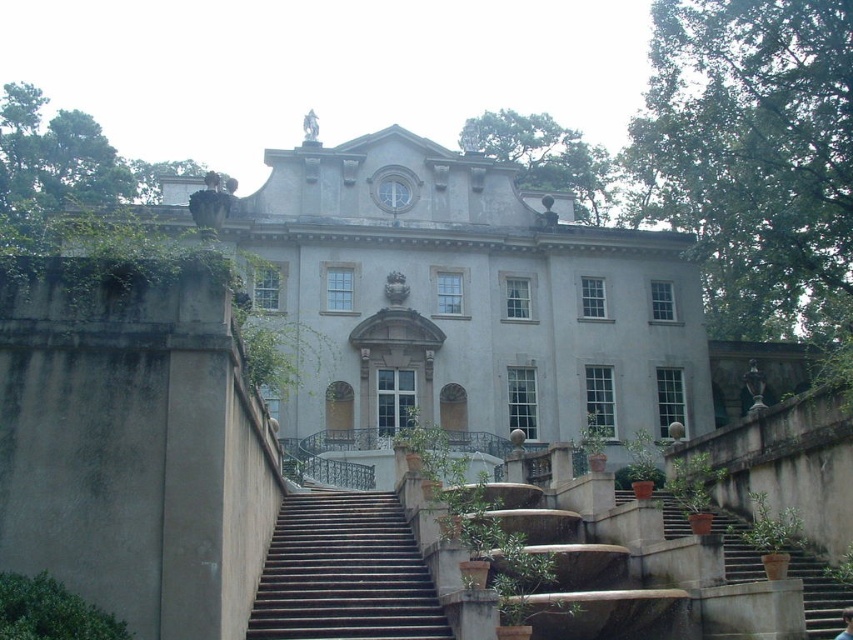
Question: Which point appears closest to the camera in this image?

Choices:
 (A) (827, 632)
 (B) (380, 412)

Answer: (A)

Question: Does white stone mansion at center have a smaller size compared to dark brown stone stairs at center?

Choices:
 (A) no
 (B) yes

Answer: (A)

Question: Which of the following is the farthest from the observer?

Choices:
 (A) (585, 244)
 (B) (293, 515)

Answer: (A)

Question: Is dark brown stone stairs at center bigger than brown concrete stairs at lower right?

Choices:
 (A) yes
 (B) no

Answer: (B)

Question: Is white stone mansion at center to the left of dark brown stone stairs at center from the viewer's perspective?

Choices:
 (A) yes
 (B) no

Answer: (B)

Question: Based on their relative distances, which object is farther from the dark brown stone stairs at center?

Choices:
 (A) brown concrete stairs at lower right
 (B) white stone mansion at center

Answer: (B)